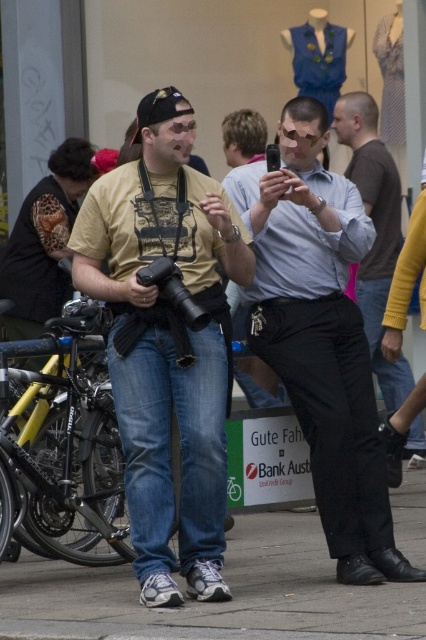
Question: Can you confirm if matte blue shirt at center is wider than black leather pants at right?

Choices:
 (A) no
 (B) yes

Answer: (B)

Question: In this image, where is matte yellow t-shirt at center located relative to concrete sidewalk at center?

Choices:
 (A) above
 (B) below

Answer: (A)

Question: Is matte yellow t-shirt at center below matte blue shirt at center?

Choices:
 (A) no
 (B) yes

Answer: (B)

Question: Among these points, which one is farthest from the camera?

Choices:
 (A) (213, 264)
 (B) (391, 211)
 (C) (333, 468)
 (D) (416, 529)

Answer: (B)

Question: Which of these objects is positioned farthest from the matte yellow t-shirt at center?

Choices:
 (A) black leather pants at right
 (B) matte blue shirt at center

Answer: (A)

Question: Estimate the real-world distances between objects in this image. Which object is farther from the black leather pants at right?

Choices:
 (A) matte yellow t-shirt at center
 (B) concrete sidewalk at center
 (C) matte blue shirt at center

Answer: (B)